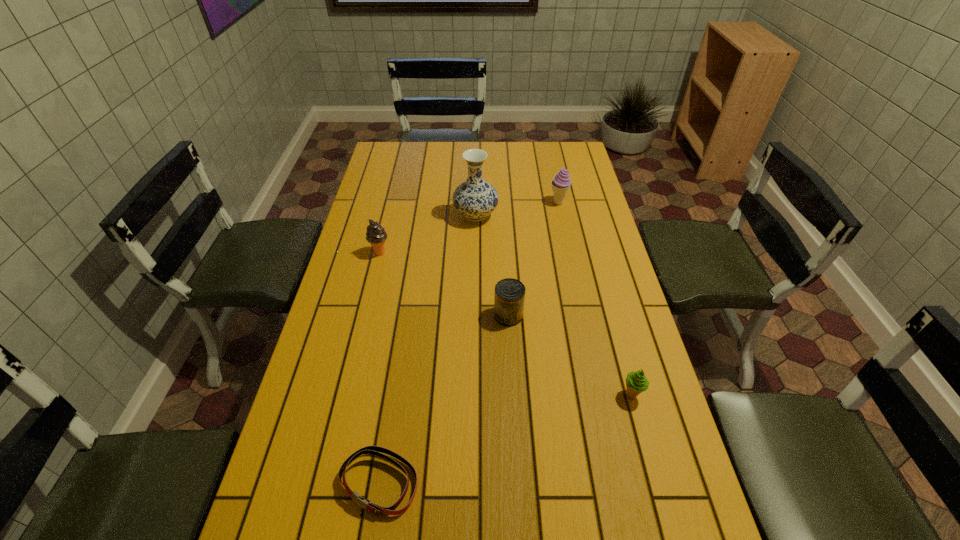
Identify the location of free space at the right edge of the desktop. The width and height of the screenshot is (960, 540). (640, 423).

In the image, there is a desktop. Where is `vacant space at the far left corner`? vacant space at the far left corner is located at coordinates (378, 168).

At what (x,y) coordinates should I click in order to perform the action: click on blank region between the second icecream from right to left and the fourth farthest object. Please return your answer as a coordinate pair (x, y). The height and width of the screenshot is (540, 960). Looking at the image, I should click on (534, 259).

The width and height of the screenshot is (960, 540). I want to click on empty space between the fourth farthest object and the shortest object, so click(444, 399).

Locate an element on the screen. Image resolution: width=960 pixels, height=540 pixels. unoccupied area between the fourth farthest object and the nearest object is located at coordinates (444, 399).

This screenshot has height=540, width=960. Find the location of `free space between the farthest icecream and the rightmost icecream`. free space between the farthest icecream and the rightmost icecream is located at coordinates (595, 299).

What are the coordinates of `free space between the can and the dog collar` in the screenshot? It's located at (444, 399).

Find the location of a particular element. empty space that is in between the dog collar and the third nearest object is located at coordinates (444, 399).

Identify the location of blank region between the third nearest object and the dog collar. (444, 399).

I want to click on vacant area that lies between the shortest object and the can, so click(444, 399).